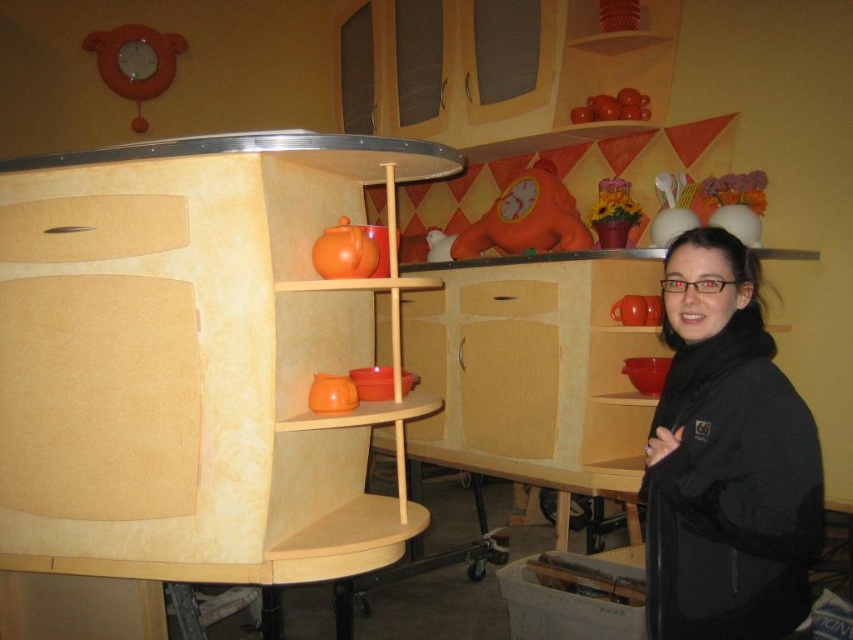
Based on the photo, who is positioned more to the right, black soft jacket at right or white cardboard box at lower center?

black soft jacket at right

Which of these two, black soft jacket at right or white cardboard box at lower center, stands shorter?

Standing shorter between the two is white cardboard box at lower center.

Describe the element at coordinates (726, 460) in the screenshot. The height and width of the screenshot is (640, 853). I see `black soft jacket at right` at that location.

Identify the location of black soft jacket at right. The height and width of the screenshot is (640, 853). (726, 460).